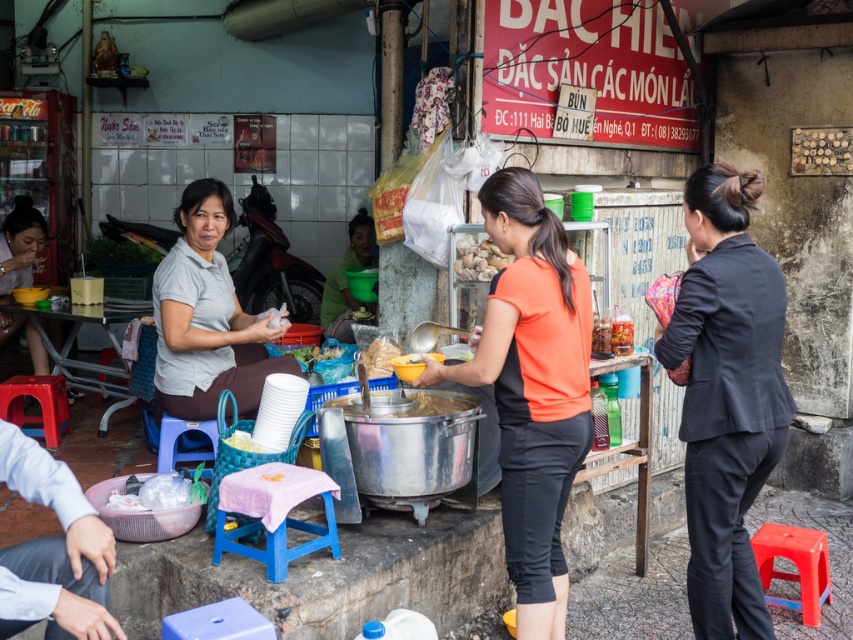
You are a customer at the street food stall and you want to choose between the shiny silver bowl at center and the yellow matte bowl at center. Which bowl would you pick if you want the one that takes up more space?

The yellow matte bowl at center takes up more space than the shiny silver bowl at center, so you should choose the yellow matte bowl at center.

You are a customer at the street food stall and want to sit down while waiting for your order. There is an orange fabric shirt at center and a blue plastic stool at lower left in your view. Which object can you sit on?

The blue plastic stool at lower left is the object you can sit on. The orange fabric shirt at center is much taller than the blue plastic stool at lower left, but shirts are not meant for sitting. Please use the stool.

Where is the shiny silver bowl at center located in the image?

The shiny silver bowl at center is located at point (479, 259).